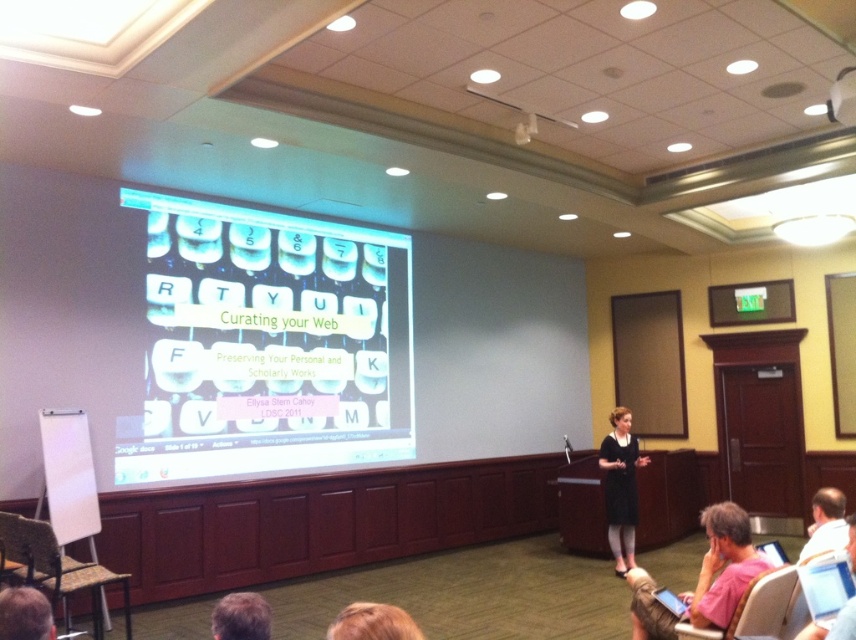
Image resolution: width=856 pixels, height=640 pixels. What are the coordinates of `translucent plastic keyboard at center` in the screenshot? It's located at (268, 342).

Which is more to the right, translucent plastic keyboard at center or black fabric dress at center?

black fabric dress at center is more to the right.

This screenshot has width=856, height=640. Describe the element at coordinates (268, 342) in the screenshot. I see `translucent plastic keyboard at center` at that location.

This screenshot has height=640, width=856. I want to click on translucent plastic keyboard at center, so click(x=268, y=342).

Does pink fabric laptop at lower right appear over blonde hair at lower left?

Correct, pink fabric laptop at lower right is located above blonde hair at lower left.

Where is `pink fabric laptop at lower right`? The image size is (856, 640). pink fabric laptop at lower right is located at coordinates (722, 566).

The height and width of the screenshot is (640, 856). Find the location of `translucent plastic keyboard at center`. translucent plastic keyboard at center is located at coordinates (268, 342).

The image size is (856, 640). What do you see at coordinates (268, 342) in the screenshot?
I see `translucent plastic keyboard at center` at bounding box center [268, 342].

This screenshot has height=640, width=856. What are the coordinates of `translucent plastic keyboard at center` in the screenshot? It's located at (268, 342).